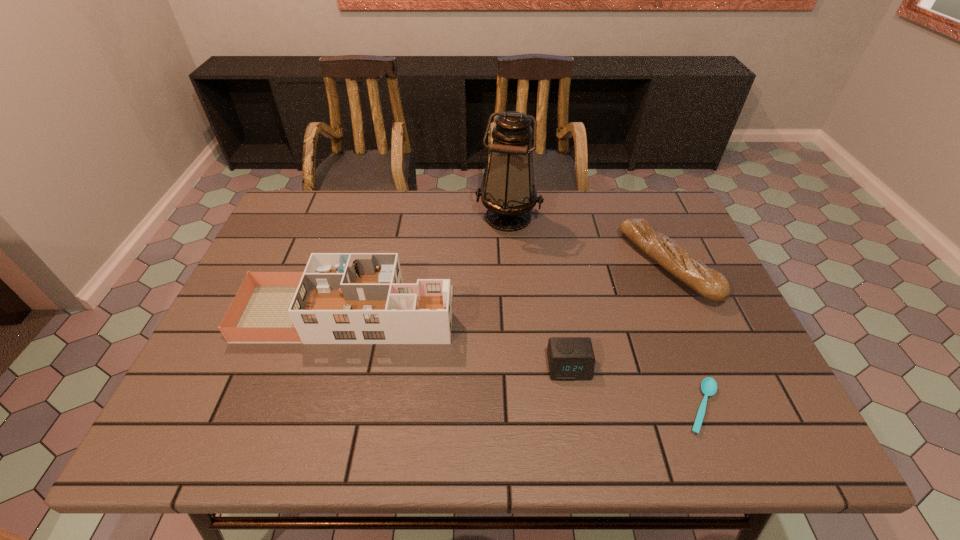
Where is `vacant position in the image that satisfies the following two spatial constraints: 1. at the front door of the dollhouse; 2. on the right side of the shortest object`? vacant position in the image that satisfies the following two spatial constraints: 1. at the front door of the dollhouse; 2. on the right side of the shortest object is located at coordinates (322, 407).

In order to click on free space that satisfies the following two spatial constraints: 1. on the back side of the shortest object; 2. on the left side of the third tallest object in this screenshot , I will do `click(647, 265)`.